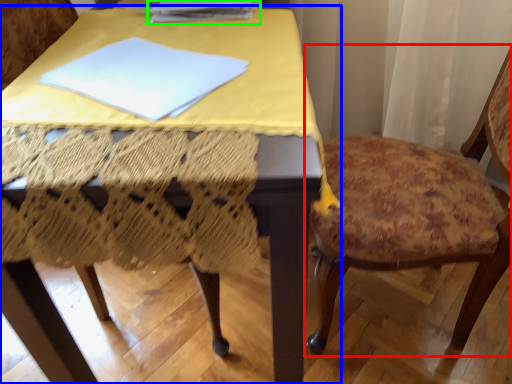
Question: Based on their relative distances, which object is nearer to chair (highlighted by a red box)? Choose from table (highlighted by a blue box) and paperback book (highlighted by a green box).

Choices:
 (A) table
 (B) paperback book

Answer: (A)